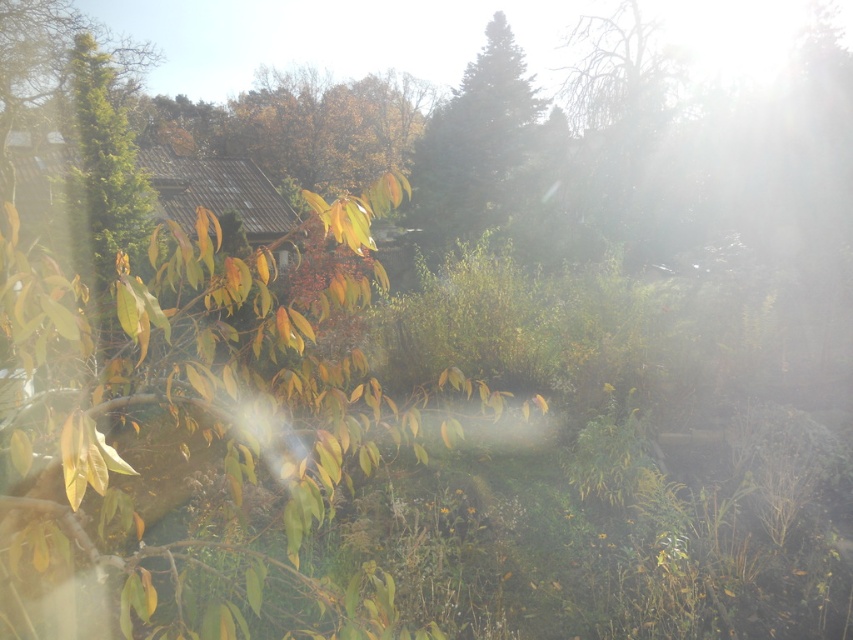
You are standing in the autumn scene and want to take a photo of both the green matte tree at center and the green textured tree at left. Which tree should you position yourself closer to in order to capture both in the frame?

To capture both the green matte tree at center and the green textured tree at left in the frame, you should position yourself closer to the green textured tree at left since it is located to the left of the green matte tree at center.

You are a photographer standing at the camera position in the scene. You want to take a closeup shot of the green matte tree at center. What should you do to ensure the tree is in focus?

Since the green matte tree at center is 22.26 meters away from the camera, you should adjust the focus distance to 22.26 meters to ensure the tree is in focus.